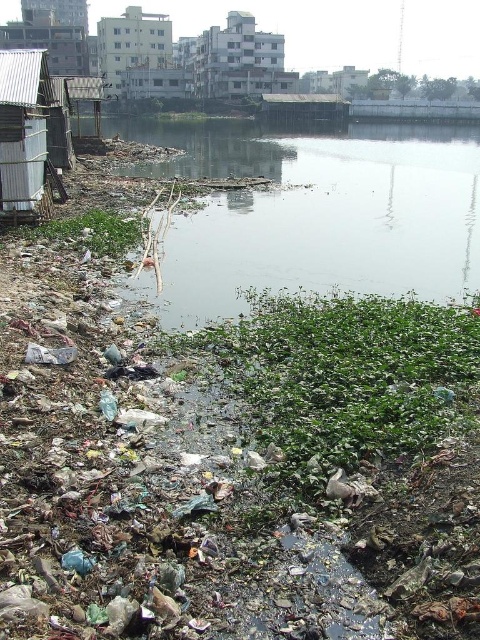
Which is more to the left, metal corrugated hut at left or white matte building at upper center?

From the viewer's perspective, white matte building at upper center appears more on the left side.

Looking at this image, does metal corrugated hut at left appear under white matte building at upper center?

Correct, metal corrugated hut at left is located below white matte building at upper center.

Is point (12, 60) positioned after point (103, 44)?

No.

The height and width of the screenshot is (640, 480). I want to click on metal corrugated hut at left, so click(x=32, y=134).

Who is more forward, [47,52] or [228,88]?

Positioned in front is point [47,52].

Which is in front, point (20, 200) or point (226, 49)?

Point (20, 200) is in front.

Identify the location of metal corrugated hut at left. (32, 134).

Can you confirm if dirty plastic debris at lower left is positioned above white matte building at upper center?

No, dirty plastic debris at lower left is not above white matte building at upper center.

At what (x,y) coordinates should I click in order to perform the action: click on dirty plastic debris at lower left. Please return your answer as a coordinate pair (x, y). The height and width of the screenshot is (640, 480). Looking at the image, I should click on (315, 211).

Measure the distance between dirty plastic debris at lower left and camera.

8.11 meters

The height and width of the screenshot is (640, 480). I want to click on dirty plastic debris at lower left, so click(315, 211).